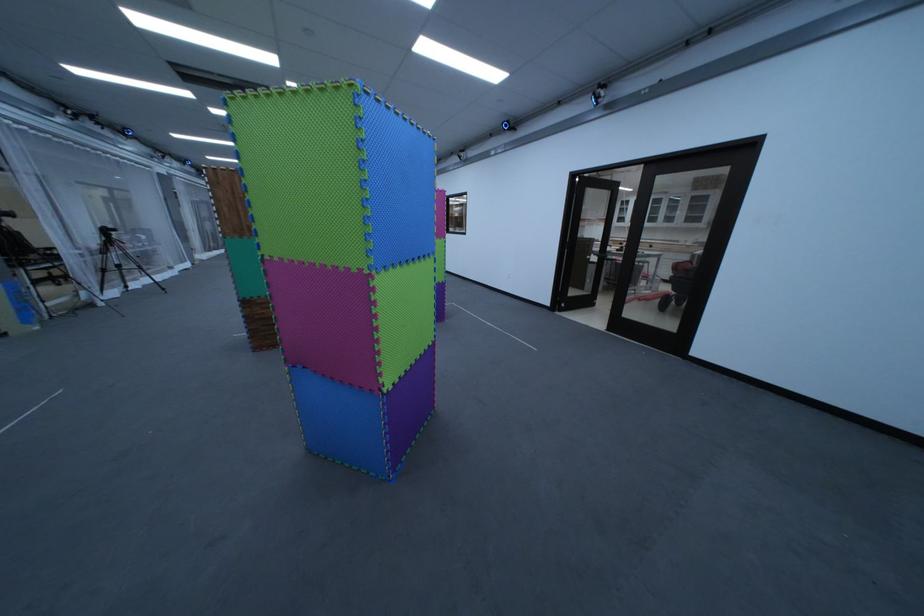
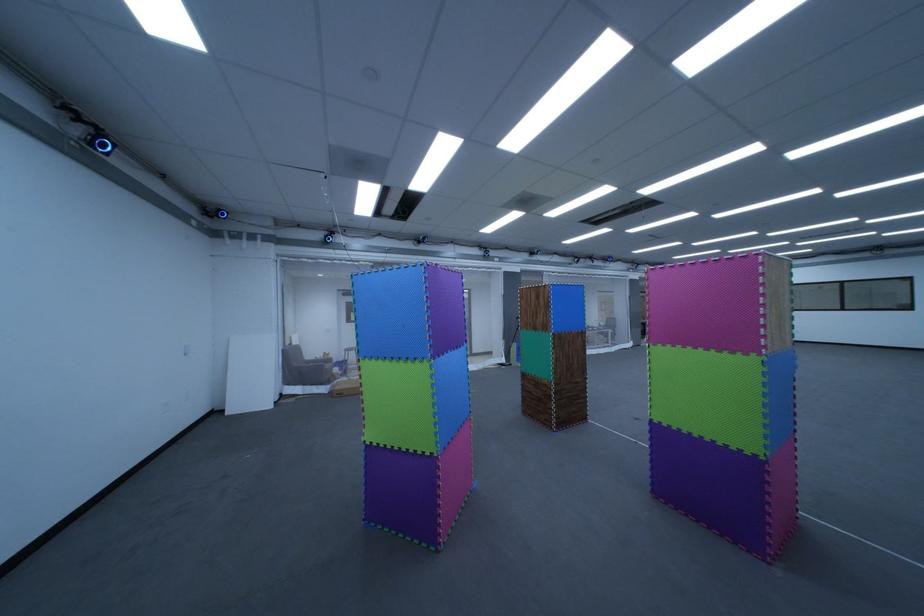
The point at (175, 175) is marked in the first image. Where is the corresponding point in the second image?

(647, 281)